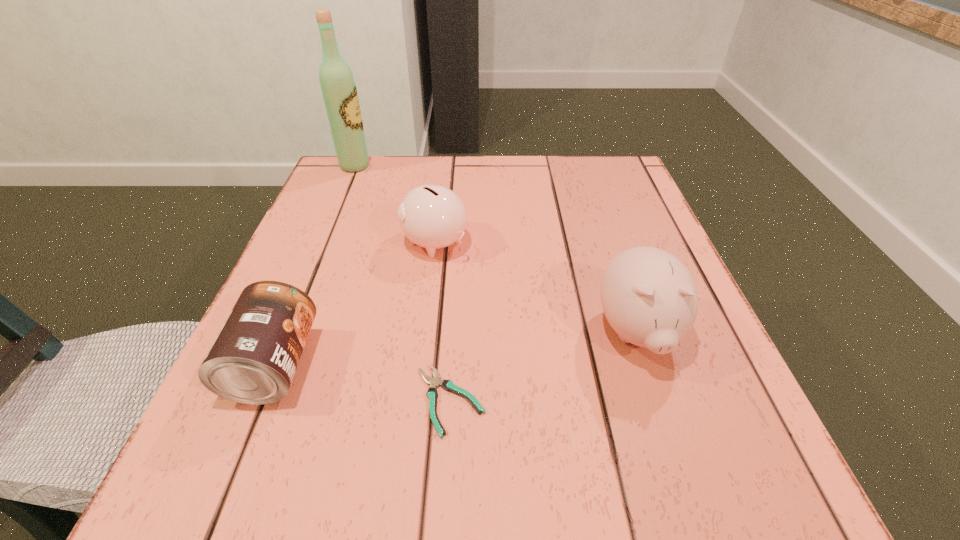
The height and width of the screenshot is (540, 960). In the image, there is a desktop. Identify the location of free space at the left edge. coord(300,245).

Locate an element on the screen. Image resolution: width=960 pixels, height=540 pixels. vacant point at the right edge is located at coordinates (637, 243).

Find the location of `free location at the far left corner of the desktop`. free location at the far left corner of the desktop is located at coordinates (344, 184).

I want to click on free region at the far right corner of the desktop, so click(x=611, y=161).

What are the coordinates of `free space at the near right corner` in the screenshot? It's located at 759,453.

Where is `vacant area that lies between the pliers and the farther piggy bank`? This screenshot has height=540, width=960. vacant area that lies between the pliers and the farther piggy bank is located at coordinates (443, 321).

Identify the location of vacant area between the tallest object and the can. (315, 265).

This screenshot has height=540, width=960. In order to click on vacant region between the tallest object and the farther piggy bank in this screenshot , I will do `click(395, 204)`.

Where is `free space between the shortest object and the nearer piggy bank`? The width and height of the screenshot is (960, 540). free space between the shortest object and the nearer piggy bank is located at coordinates (543, 366).

Find the location of a particular element. Image resolution: width=960 pixels, height=540 pixels. vacant space that is in between the nearer piggy bank and the shortest object is located at coordinates (543, 366).